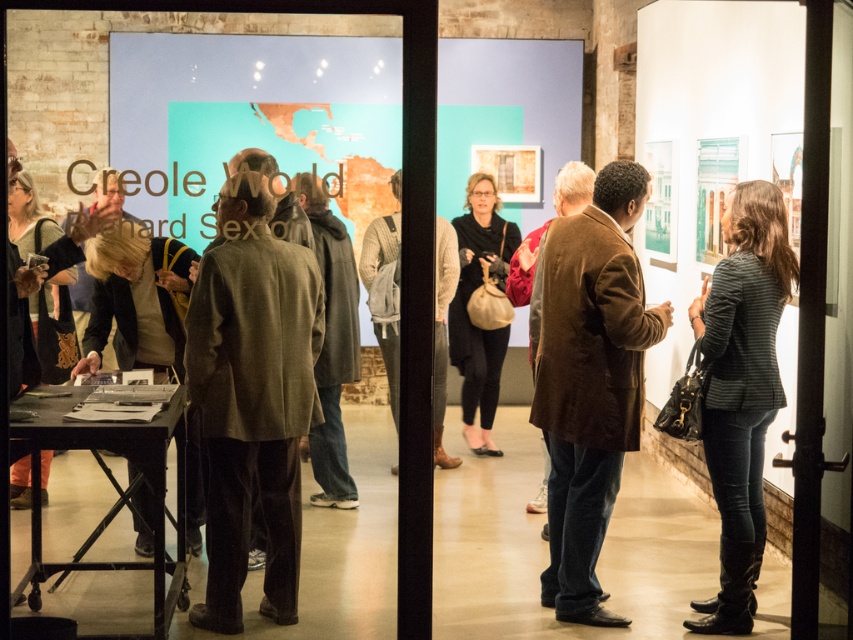
Question: Is dark brown wool coat at center closer to the viewer compared to matte black dress at center?

Choices:
 (A) yes
 (B) no

Answer: (A)

Question: Which point is closer to the camera?

Choices:
 (A) (177, 259)
 (B) (466, 289)
 (C) (572, 582)

Answer: (A)

Question: Does dark brown wool coat at center come behind matte black dress at center?

Choices:
 (A) no
 (B) yes

Answer: (A)

Question: Is striped fabric jacket at right wider than dark brown leather jacket at left?

Choices:
 (A) no
 (B) yes

Answer: (A)

Question: Which of the following is the farthest from the observer?

Choices:
 (A) dark brown leather jacket at left
 (B) brown suede jacket at center
 (C) striped fabric jacket at right

Answer: (C)

Question: Based on their relative distances, which object is nearer to the striped fabric jacket at right?

Choices:
 (A) dark brown leather jacket at left
 (B) brown suede jacket at center
 (C) matte black dress at center
 (D) dark brown wool coat at center

Answer: (B)